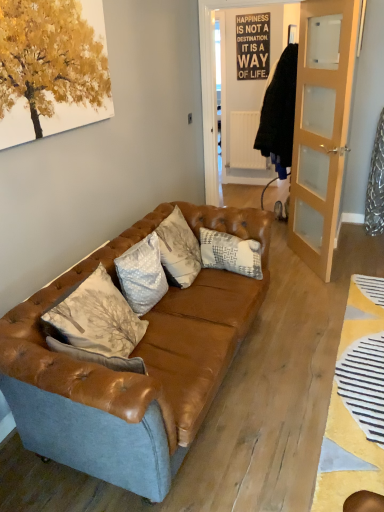
Question: Is point (233, 260) closer or farther from the camera than point (137, 310)?

Choices:
 (A) farther
 (B) closer

Answer: (A)

Question: Considering the positions of white textured pillow at center, the 2th pillow in the front-to-back sequence, and white textured pillow at center, positioned as the first pillow in front-to-back order, in the image, is white textured pillow at center, the 2th pillow in the front-to-back sequence, wider or thinner than white textured pillow at center, positioned as the first pillow in front-to-back order,?

Choices:
 (A) wide
 (B) thin

Answer: (B)

Question: Estimate the real-world distances between objects in this image. Which object is farther from the white textured pillow at center, arranged as the 1th pillow when viewed from the back?

Choices:
 (A) leather couch at center
 (B) white textured pillow at center, positioned as the first pillow in front-to-back order
 (C) light brown wooden door at right

Answer: (C)

Question: Which object is positioned farthest from the white textured pillow at center, marked as the 1th pillow in a right-to-left arrangement?

Choices:
 (A) white textured pillow at center, which is the 2th pillow in right-to-left order
 (B) light brown wooden door at right
 (C) leather couch at center

Answer: (B)